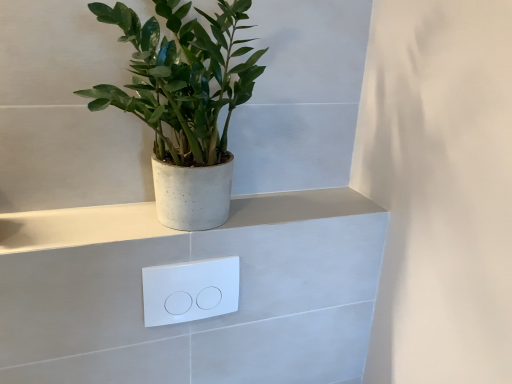
Question: Relative to white concrete ledge at upper center, is white glossy/light switch at center in front or behind?

Choices:
 (A) behind
 (B) front

Answer: (A)

Question: From the image's perspective, is white glossy/light switch at center located above or below white concrete ledge at upper center?

Choices:
 (A) above
 (B) below

Answer: (B)

Question: Which is farther from the green matte plant at upper left?

Choices:
 (A) white concrete ledge at upper center
 (B) white glossy/light switch at center

Answer: (B)

Question: Which of these objects is positioned farthest from the white glossy/light switch at center?

Choices:
 (A) white concrete ledge at upper center
 (B) green matte plant at upper left

Answer: (B)